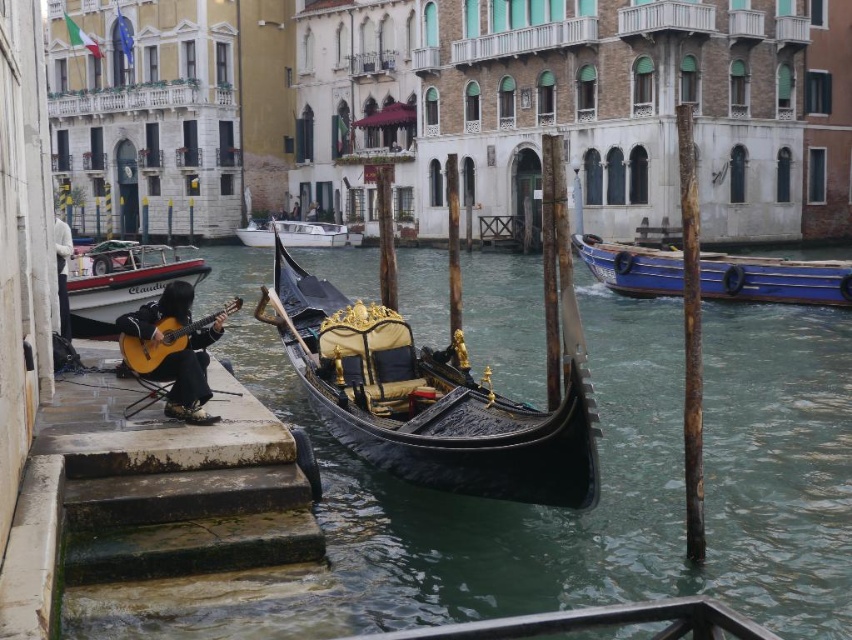
You are standing at the edge of the canal and want to take a photo of the gondola and the person playing the guitar. Which of the two points, point [593,428] or point [654,275], will appear larger in your photo?

Point [593,428] will appear larger in the photo because it is closer to the camera than point [654,275].

You are a tourist standing on the canal bridge and want to take a photo of the white plastic boat at left and the white fabric jacket at left. Which object should you focus on first to ensure both are in the frame?

You should focus on the white plastic boat at left first because it is closer to you than the white fabric jacket at left, so it will appear larger in the photo. By centering the white plastic boat at left first, you can then adjust the frame to include the white fabric jacket at left without losing the boat from the shot.